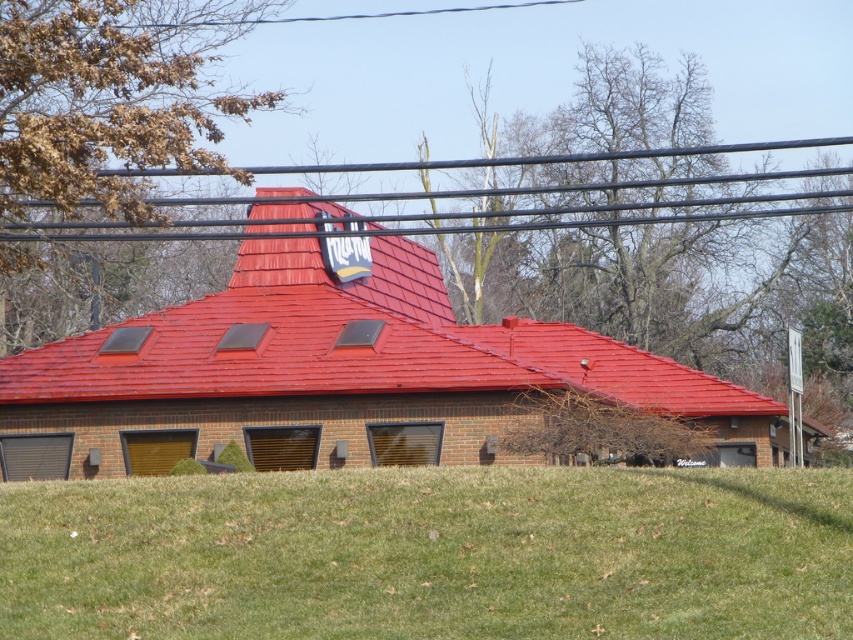
You are standing at the entrance of the building and want to walk towards the green grass at lower center. What coordinates should you aim for to reach it?

The green grass at lower center is located at coordinates point (x=431, y=554), so you should aim for that point to reach it.

You are standing in front of the building and want to walk towards the shiny red tile roof at center. Which direction should you walk to avoid stepping on the green grass at lower center?

The green grass at lower center is positioned on the right side of the shiny red tile roof at center. To avoid stepping on the green grass at lower center, you should walk to the left side of the shiny red tile roof at center.